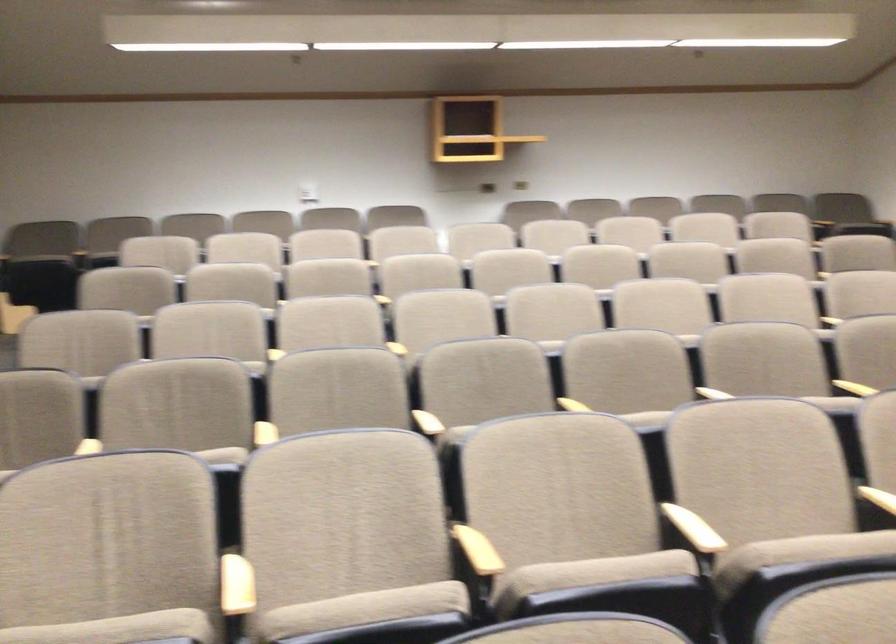
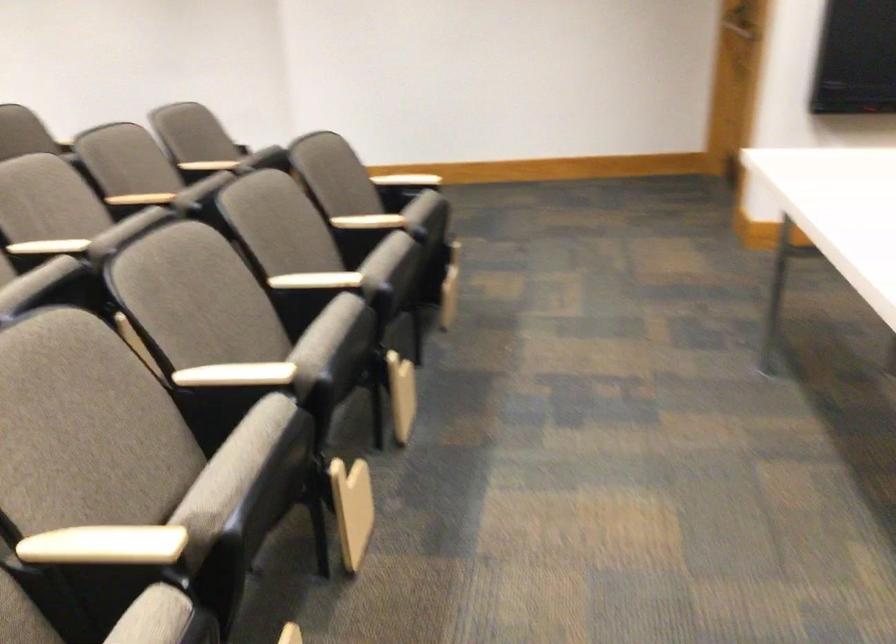
Based on the continuous images, in which direction is the camera rotating?

The rotation direction of the camera is right-down.